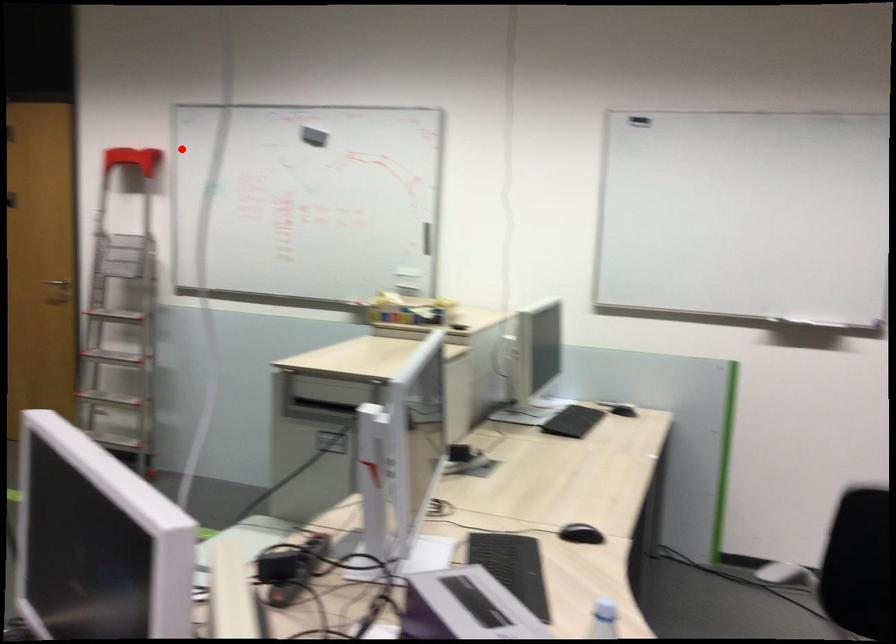
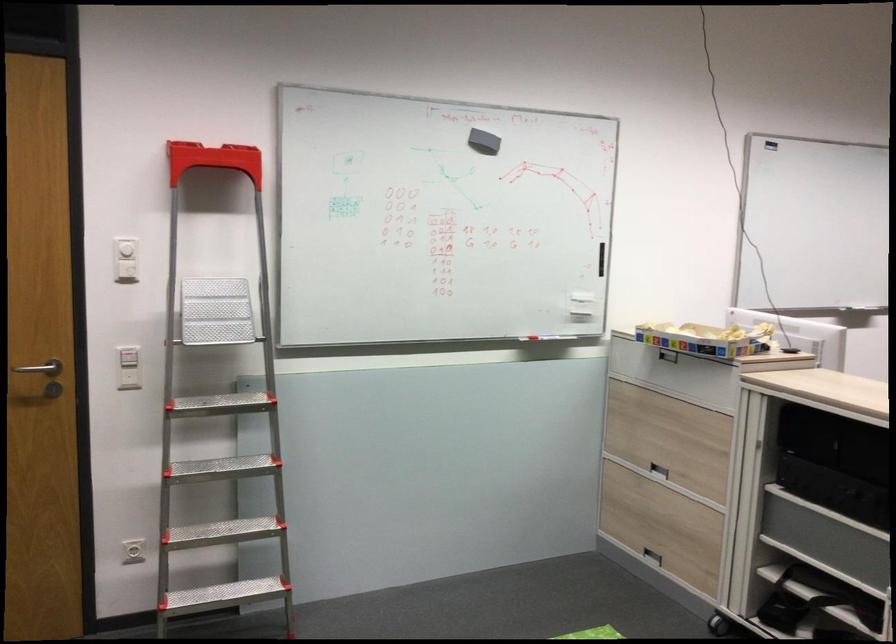
Question: I am providing you with two images of the same scene from different viewpoints. In image1, a red point is highlighted. Considering the same 3D point in image2, which of the following is correct?

Choices:
 (A) It is closer
 (B) It is farther

Answer: (A)